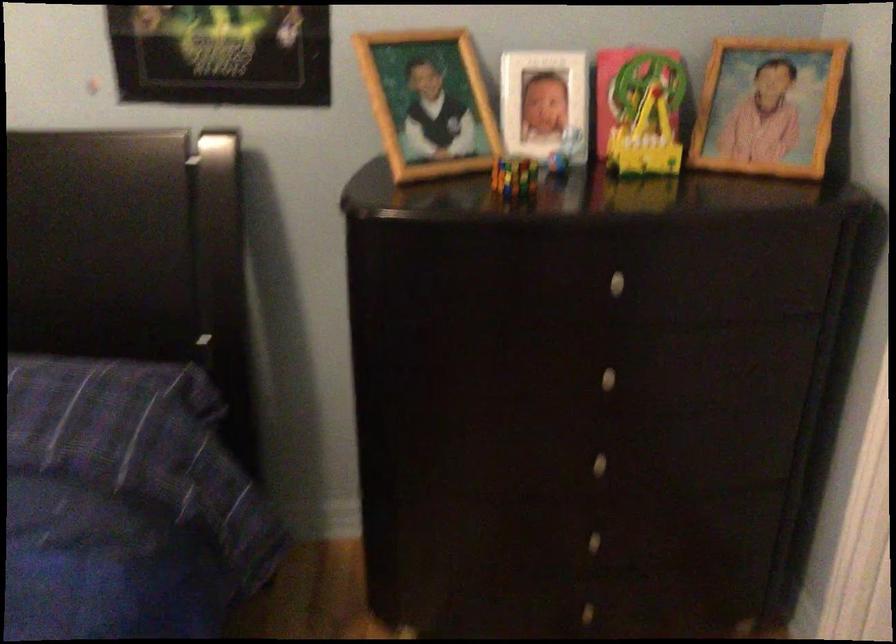
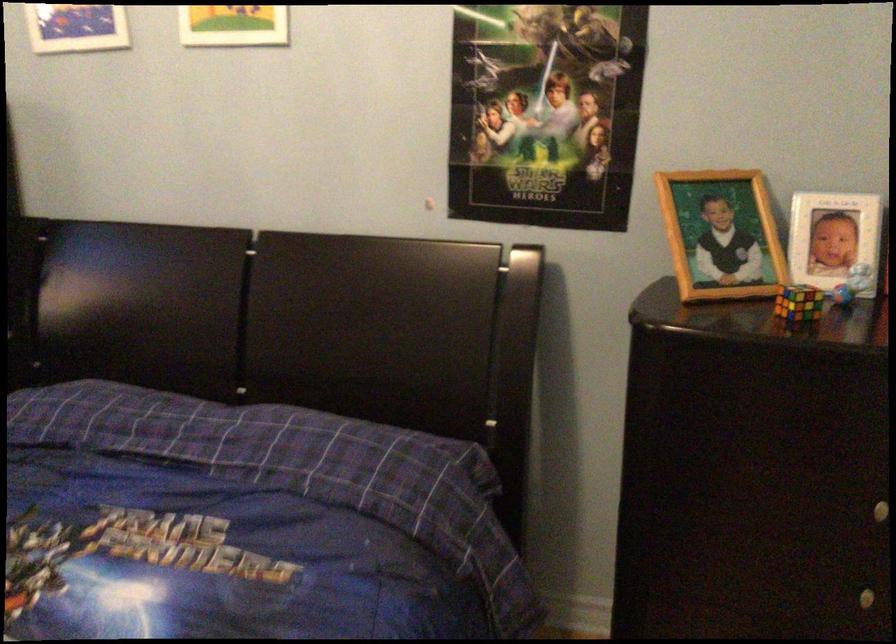
Locate, in the second image, the point that corresponds to pixel 510 172 in the first image.

(798, 303)